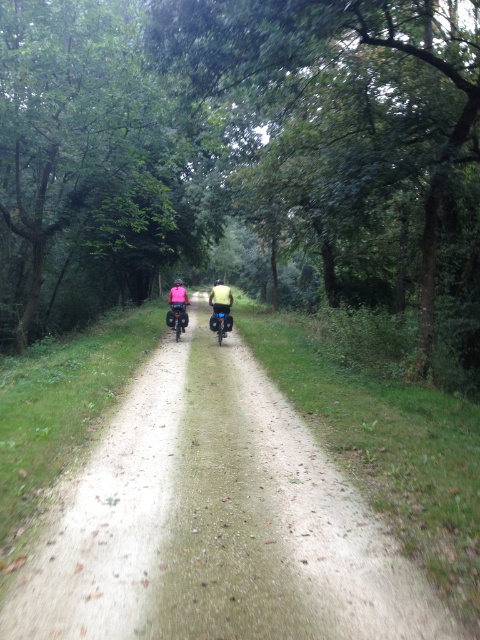
Is green leafy tree at center taller than dirt path at center?

Yes.

Is green leafy tree at center positioned before dirt path at center?

No, it is behind dirt path at center.

The image size is (480, 640). Describe the element at coordinates (244, 160) in the screenshot. I see `green leafy tree at center` at that location.

Find the location of a particular element. This screenshot has width=480, height=640. green leafy tree at center is located at coordinates (244, 160).

Is point (216, 285) positioned after point (181, 292)?

That is False.

Is point (217, 305) positioned in front of point (173, 300)?

That is True.

Where is `yellow-green fabric shirt at center`? yellow-green fabric shirt at center is located at coordinates (220, 305).

Which is more to the right, dirt path at center or pink fabric jacket at center?

dirt path at center

The height and width of the screenshot is (640, 480). Identify the location of dirt path at center. pyautogui.click(x=215, y=522).

Is point (133, 388) in front of point (180, 288)?

Yes.

The height and width of the screenshot is (640, 480). Identify the location of dirt path at center. (215, 522).